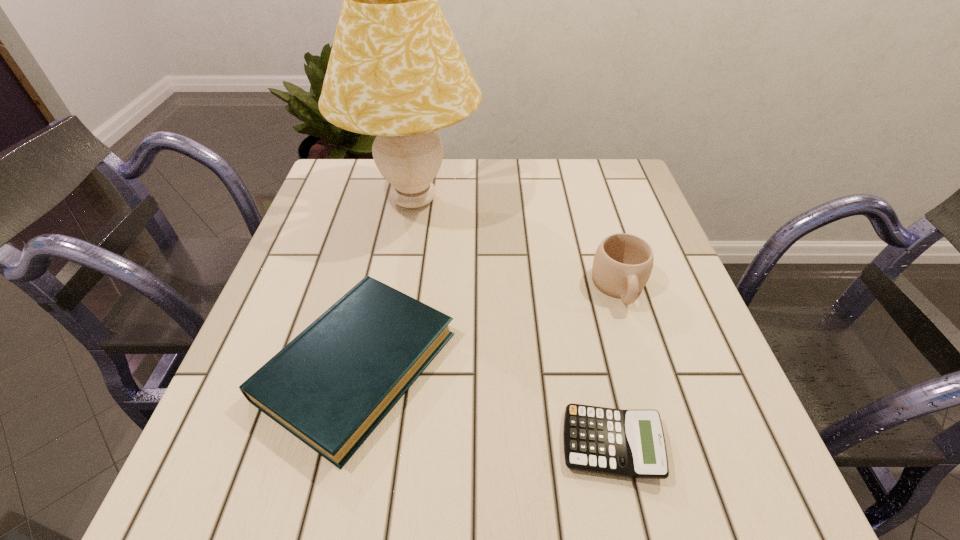
Identify the location of empty space between the calculator and the third tallest object. (485, 405).

Where is `empty space that is in between the lampshade and the book`? The height and width of the screenshot is (540, 960). empty space that is in between the lampshade and the book is located at coordinates (386, 283).

Locate an element on the screen. empty space that is in between the tallest object and the calculator is located at coordinates (513, 322).

Locate an element on the screen. Image resolution: width=960 pixels, height=540 pixels. vacant area that lies between the book and the tallest object is located at coordinates (386, 283).

You are a GUI agent. You are given a task and a screenshot of the screen. Output one action in this format:
    pyautogui.click(x=<x>, y=<y>)
    Task: Click on the empty space that is in between the second tallest object and the calculator
    This screenshot has height=540, width=960.
    Given the screenshot: What is the action you would take?
    pyautogui.click(x=615, y=365)

Locate an element on the screen. The width and height of the screenshot is (960, 540). vacant space in between the third tallest object and the calculator is located at coordinates [x=485, y=405].

Find the location of `object that is the third closest to the second tallest object`. object that is the third closest to the second tallest object is located at coordinates (331, 386).

At what (x,y) coordinates should I click in order to perform the action: click on the third closest object to the mug. Please return your answer as a coordinate pair (x, y). Looking at the image, I should click on (331, 386).

What are the coordinates of `vacant space that satisfies the following two spatial constraints: 1. on the front side of the second shortest object; 2. on the left side of the calculator` in the screenshot? It's located at (340, 444).

Find the location of a particular element. The height and width of the screenshot is (540, 960). free region that satisfies the following two spatial constraints: 1. on the front side of the calculator; 2. on the left side of the third tallest object is located at coordinates (340, 444).